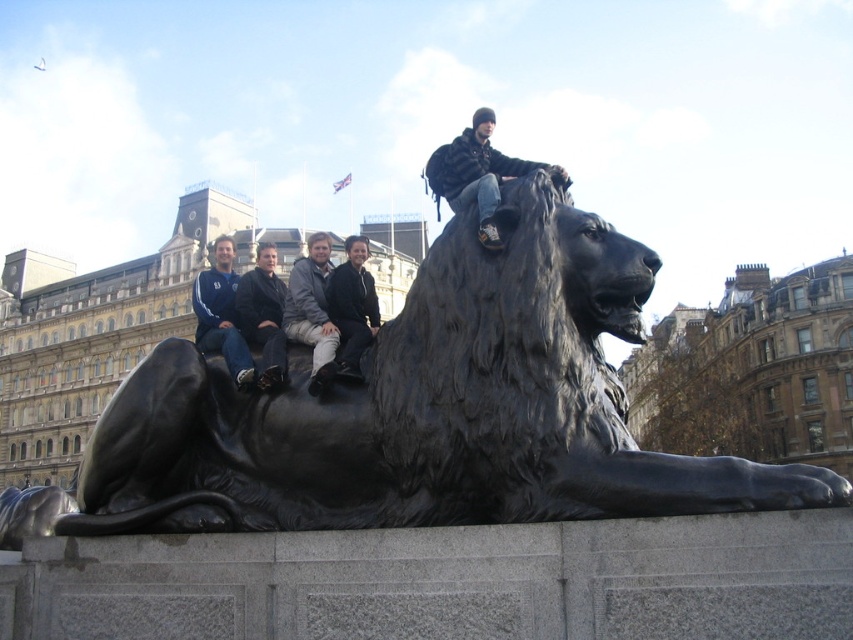
Between matte black jacket at upper center and gray fabric jacket at upper center, which one is positioned higher?

matte black jacket at upper center is above.

Is matte black jacket at upper center smaller than gray fabric jacket at upper center?

→ Indeed, matte black jacket at upper center has a smaller size compared to gray fabric jacket at upper center.

Which is in front, point (461, 209) or point (329, 243)?

Point (461, 209)

Where is `matte black jacket at upper center`? The width and height of the screenshot is (853, 640). matte black jacket at upper center is located at coordinates (479, 173).

Does point (479, 180) come in front of point (358, 355)?

No.

Is matte black jacket at upper center below black matte jacket at upper center?

No, matte black jacket at upper center is not below black matte jacket at upper center.

Identify the location of matte black jacket at upper center. Image resolution: width=853 pixels, height=640 pixels. (479, 173).

Where is `matte black jacket at upper center`? Image resolution: width=853 pixels, height=640 pixels. matte black jacket at upper center is located at coordinates (479, 173).

Does black polished stone lion at center appear over dark brown leather jacket at center?

No.

The height and width of the screenshot is (640, 853). Describe the element at coordinates (421, 412) in the screenshot. I see `black polished stone lion at center` at that location.

At what (x,y) coordinates should I click in order to perform the action: click on black polished stone lion at center. Please return your answer as a coordinate pair (x, y). The width and height of the screenshot is (853, 640). Looking at the image, I should click on (421, 412).